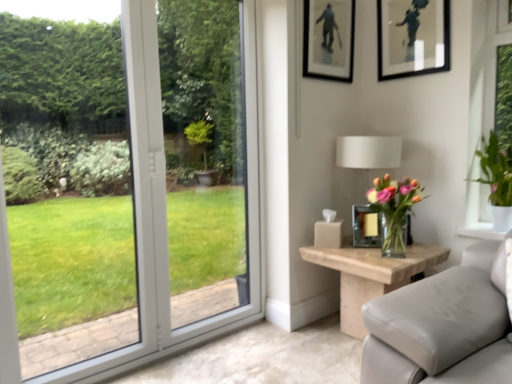
Question: Would you say green leafy plant at right, arranged as the second houseplant when viewed from the left, is outside translucent glass vase at right, placed as the 1th houseplant when sorted from left to right?

Choices:
 (A) no
 (B) yes

Answer: (B)

Question: Does green leafy plant at right, which is the first houseplant in right-to-left order, turn towards translucent glass vase at right, placed as the 1th houseplant when sorted from left to right?

Choices:
 (A) yes
 (B) no

Answer: (B)

Question: Does green leafy plant at right, arranged as the second houseplant when viewed from the left, come behind translucent glass vase at right, placed as the 1th houseplant when sorted from left to right?

Choices:
 (A) yes
 (B) no

Answer: (A)

Question: From the image's perspective, is green leafy plant at right, which is the first houseplant in right-to-left order, on translucent glass vase at right, the 2th houseplant positioned from the right?

Choices:
 (A) no
 (B) yes

Answer: (B)

Question: Is green leafy plant at right, arranged as the second houseplant when viewed from the left, directly adjacent to translucent glass vase at right, placed as the 1th houseplant when sorted from left to right?

Choices:
 (A) no
 (B) yes

Answer: (A)

Question: Is translucent glass vase at right, the 2th houseplant positioned from the right, spatially inside matte black picture frame at upper center, marked as the second picture frame in a bottom-to-top arrangement, or outside of it?

Choices:
 (A) inside
 (B) outside

Answer: (B)

Question: Based on their positions, is translucent glass vase at right, placed as the 1th houseplant when sorted from left to right, located to the left or right of matte black picture frame at upper center, positioned as the first picture frame in left-to-right order?

Choices:
 (A) left
 (B) right

Answer: (B)

Question: From a real-world perspective, relative to matte black picture frame at upper center, positioned as the first picture frame in left-to-right order, is translucent glass vase at right, placed as the 1th houseplant when sorted from left to right, vertically above or below?

Choices:
 (A) above
 (B) below

Answer: (B)

Question: From the image's perspective, is translucent glass vase at right, the 2th houseplant positioned from the right, positioned above or below matte black picture frame at upper center, marked as the second picture frame in a bottom-to-top arrangement?

Choices:
 (A) above
 (B) below

Answer: (B)

Question: From the image's perspective, is natural wood side table at right located above or below metallic gold picture frame at right, positioned as the 2th picture frame in right-to-left order?

Choices:
 (A) below
 (B) above

Answer: (A)

Question: In terms of size, does natural wood side table at right appear bigger or smaller than metallic gold picture frame at right, the second picture frame from the left?

Choices:
 (A) big
 (B) small

Answer: (A)

Question: In terms of width, does natural wood side table at right look wider or thinner when compared to metallic gold picture frame at right, which is counted as the third picture frame, starting from the top?

Choices:
 (A) thin
 (B) wide

Answer: (B)

Question: Is natural wood side table at right to the left or to the right of metallic gold picture frame at right, which is counted as the third picture frame, starting from the top, in the image?

Choices:
 (A) right
 (B) left

Answer: (A)

Question: Looking at their shapes, would you say natural wood side table at right is wider or thinner than white fabric lampshade at upper right?

Choices:
 (A) wide
 (B) thin

Answer: (A)

Question: From their relative heights in the image, would you say natural wood side table at right is taller or shorter than white fabric lampshade at upper right?

Choices:
 (A) tall
 (B) short

Answer: (B)